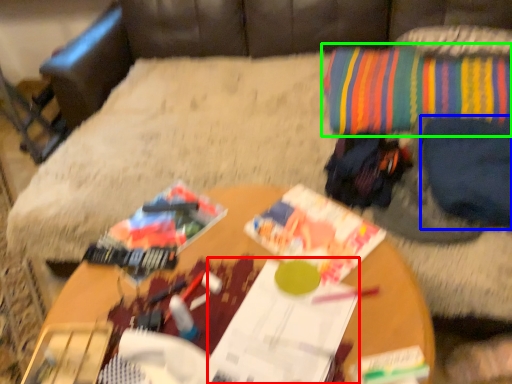
Question: Based on their relative distances, which object is farther from magazine (highlighted by a red box)? Choose from clothing (highlighted by a blue box) and throw pillow (highlighted by a green box).

Choices:
 (A) clothing
 (B) throw pillow

Answer: (B)